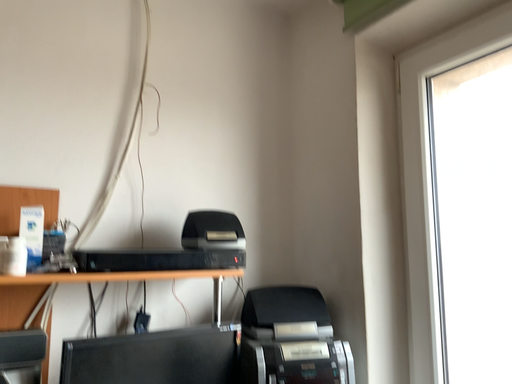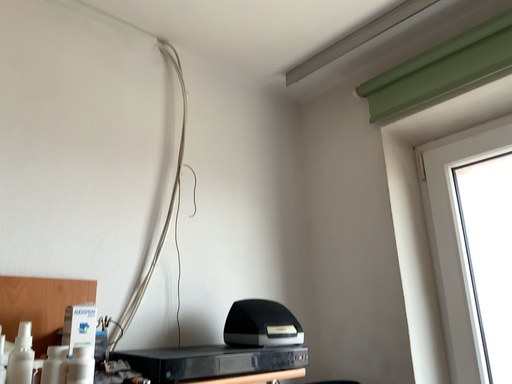
Question: Which way did the camera rotate in the video?

Choices:
 (A) rotated left
 (B) rotated right

Answer: (B)